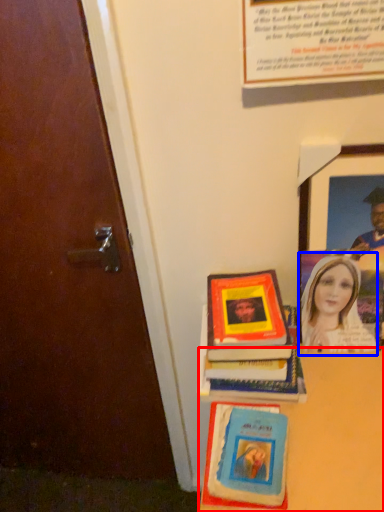
Question: Which of the following is the closest to the observer, table (highlighted by a red box) or woman (highlighted by a blue box)?

Choices:
 (A) table
 (B) woman

Answer: (A)